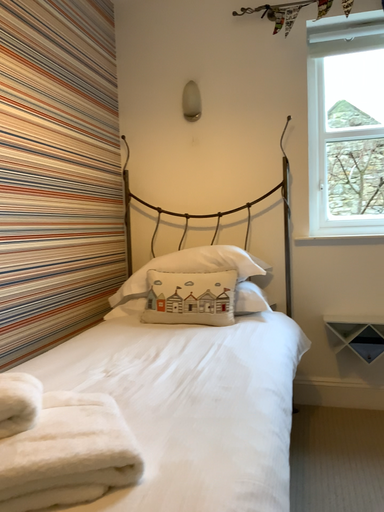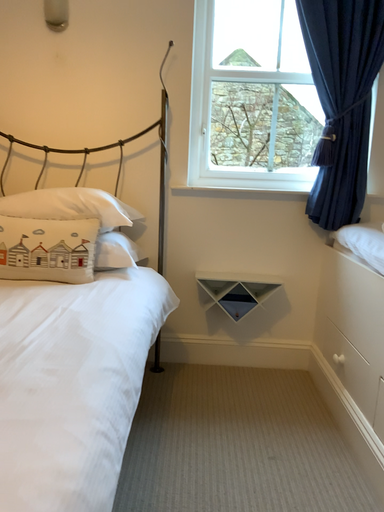
Question: How did the camera likely rotate when shooting the video?

Choices:
 (A) rotated downward
 (B) rotated upward

Answer: (A)